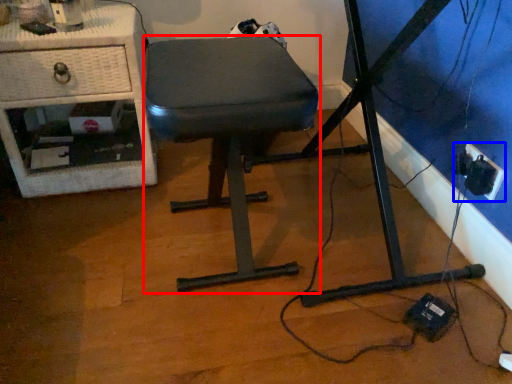
Question: Which point is further to the camera, stool (highlighted by a red box) or electric outlet (highlighted by a blue box)?

Choices:
 (A) stool
 (B) electric outlet

Answer: (B)